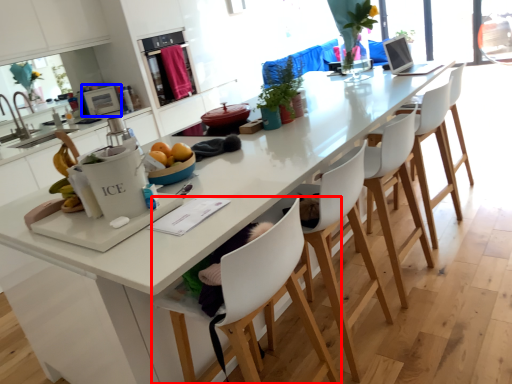
Question: Which object appears farthest to the camera in this image, chair (highlighted by a red box) or appliance (highlighted by a blue box)?

Choices:
 (A) chair
 (B) appliance

Answer: (B)